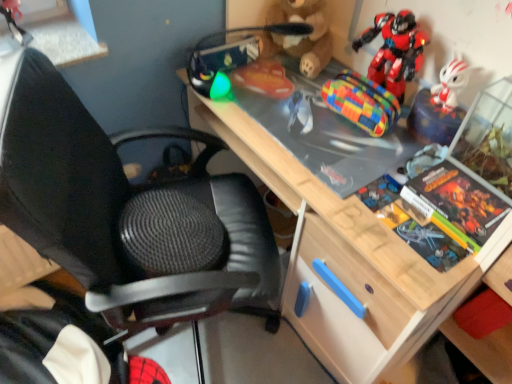
Identify the location of vacant space to the left of shiny plastic robot at upper right, which appears as the 1th toy when viewed from the right. (311, 106).